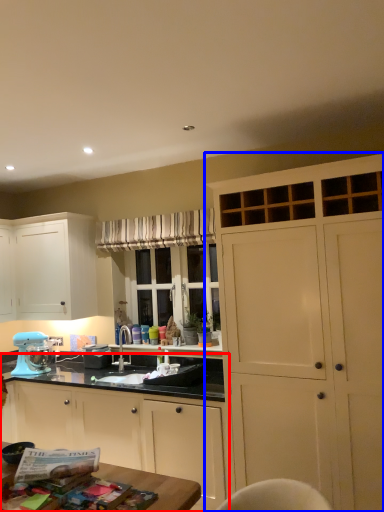
Question: Which object appears farthest to the camera in this image, cabinetry (highlighted by a red box) or cabinetry (highlighted by a blue box)?

Choices:
 (A) cabinetry
 (B) cabinetry

Answer: (A)